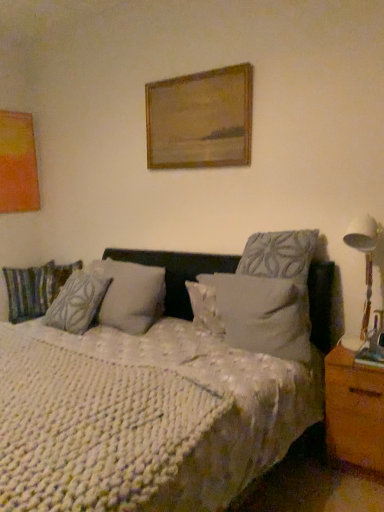
What is the approximate height of white fabric lampshade at right?

65.51 centimeters.

Identify the location of white fabric lampshade at right. Image resolution: width=384 pixels, height=512 pixels. (365, 266).

How many degrees apart are the facing directions of white textured pillow at center, the fourth pillow positioned from the back, and striped fabric pillow at left, the 4th pillow viewed from the right?

The angle between the facing direction of white textured pillow at center, the fourth pillow positioned from the back, and the facing direction of striped fabric pillow at left, the 4th pillow viewed from the right, is 79.6 degrees.

From a real-world perspective, is white textured pillow at center, the 3th pillow in the left-to-right sequence, beneath striped fabric pillow at left, the 4th pillow viewed from the right?

No, from a real-world perspective, white textured pillow at center, the 3th pillow in the left-to-right sequence, is not below striped fabric pillow at left, the 4th pillow viewed from the right.

Considering the positions of point (250, 296) and point (15, 288), is point (250, 296) closer or farther from the camera than point (15, 288)?

Point (250, 296) appears to be closer to the viewer than point (15, 288).

Looking at the image, does white textured pillow at center, the 3th pillow in the left-to-right sequence, seem bigger or smaller compared to striped fabric pillow at left, marked as the 1th pillow in a back-to-front arrangement?

Clearly, white textured pillow at center, the 3th pillow in the left-to-right sequence, is larger in size than striped fabric pillow at left, marked as the 1th pillow in a back-to-front arrangement.

Is striped fabric pillow at left, marked as the 1th pillow in a back-to-front arrangement, looking in the opposite direction of white knitted mattress at center?

No, striped fabric pillow at left, marked as the 1th pillow in a back-to-front arrangement,'s orientation is not away from white knitted mattress at center.

Between point (52, 282) and point (74, 466), which one is positioned in front?

The point (74, 466) is more forward.

From a real-world perspective, who is located higher, striped fabric pillow at left, which is the first pillow in left-to-right order, or white knitted mattress at center?

striped fabric pillow at left, which is the first pillow in left-to-right order, from a real-world perspective.

Are striped fabric pillow at left, the 4th pillow viewed from the right, and white textured pillow at center, the fourth pillow positioned from the back, far apart?

Yes, striped fabric pillow at left, the 4th pillow viewed from the right, and white textured pillow at center, the fourth pillow positioned from the back, are quite far apart.

Which point is more forward, (x=32, y=318) or (x=246, y=312)?

The point (x=246, y=312) is in front.

Is striped fabric pillow at left, marked as the 1th pillow in a back-to-front arrangement, located outside white textured pillow at center, the fourth pillow positioned from the back?

Yes, striped fabric pillow at left, marked as the 1th pillow in a back-to-front arrangement, is outside of white textured pillow at center, the fourth pillow positioned from the back.

Locate an element on the screen. The image size is (384, 512). the 2nd pillow to the right when counting from the striped fabric pillow at left, the fourth pillow when ordered from front to back is located at coordinates (262, 314).

Is textured gray pillow at center, the second pillow when ordered from front to back, wider or thinner than white knitted mattress at center?

In the image, textured gray pillow at center, the second pillow when ordered from front to back, appears to be more narrow than white knitted mattress at center.

Is point (290, 247) positioned after point (195, 444)?

Yes, it is behind point (195, 444).

The image size is (384, 512). I want to click on mattress located on the left of textured gray pillow at center, acting as the third pillow starting from the back, so click(x=92, y=426).

Which is closer, (147,452) or (354,229)?

Point (147,452)

Are white knitted blanket at center and white fabric lampshade at right far apart?

No, white knitted blanket at center is not far away from white fabric lampshade at right.

Consider the image. Is white knitted blanket at center shorter than white fabric lampshade at right?

In fact, white knitted blanket at center may be taller than white fabric lampshade at right.

The image size is (384, 512). In order to click on table lamp on the left of the brown wood nightstand at lower right in this screenshot , I will do `click(365, 266)`.

Is brown wood nightstand at lower right spatially inside white fabric lampshade at right, or outside of it?

brown wood nightstand at lower right is located beyond the bounds of white fabric lampshade at right.

Considering the points (351, 401) and (360, 331), which point is in front, point (351, 401) or point (360, 331)?

The point (351, 401) is closer to the camera.

Can you confirm if brown wood nightstand at lower right is taller than white fabric lampshade at right?

No, brown wood nightstand at lower right is not taller than white fabric lampshade at right.

Is striped fabric pillow at left, which is the first pillow in left-to-right order, inside the boundaries of white fabric lampshade at right, or outside?

striped fabric pillow at left, which is the first pillow in left-to-right order, is not inside white fabric lampshade at right, it's outside.

Does striped fabric pillow at left, which is the first pillow in left-to-right order, have a smaller size compared to white fabric lampshade at right?

Incorrect, striped fabric pillow at left, which is the first pillow in left-to-right order, is not smaller in size than white fabric lampshade at right.

From the image's perspective, which is above, striped fabric pillow at left, the fourth pillow when ordered from front to back, or white fabric lampshade at right?

white fabric lampshade at right, from the image's perspective.

In the scene shown: Which point is more distant from viewer, (x=17, y=314) or (x=357, y=349)?

Positioned behind is point (x=17, y=314).

The width and height of the screenshot is (384, 512). What are the coordinates of `the 3rd pillow in front of the striped fabric pillow at left, marked as the 1th pillow in a back-to-front arrangement, counting from the anchor's position` in the screenshot? It's located at (262, 314).

The image size is (384, 512). In the image, there is a striped fabric pillow at left, marked as the 1th pillow in a back-to-front arrangement. Identify the location of mattress below it (from a real-world perspective). (92, 426).

Based on the photo, based on their spatial positions, is wooden framed painting at upper center or white fabric lampshade at right further from striped fabric pillow at left, which is the first pillow in left-to-right order?

The object further to striped fabric pillow at left, which is the first pillow in left-to-right order, is white fabric lampshade at right.

Looking at the image, which one is located closer to striped fabric pillow at left, the fourth pillow when ordered from front to back, white knitted blanket at center or white textured pillow at center, the 2th pillow in the right-to-left sequence?

white knitted blanket at center is positioned closer to the anchor striped fabric pillow at left, the fourth pillow when ordered from front to back.

Considering their positions, is white fabric lampshade at right positioned further to wooden framed painting at upper center than white textured pillow at center, the 2th pillow in the right-to-left sequence?

white fabric lampshade at right is positioned further to the anchor wooden framed painting at upper center.

When comparing their distances from white fabric lampshade at right, does striped fabric pillow at left, the fourth pillow when ordered from front to back, or wooden framed painting at upper center seem further?

striped fabric pillow at left, the fourth pillow when ordered from front to back, lies further to white fabric lampshade at right than the other object.

When comparing their distances from textured gray pillow at center, acting as the second pillow starting from the left, does striped fabric pillow at left, which is the first pillow in left-to-right order, or white knitted blanket at center seem closer?

Among the two, white knitted blanket at center is located nearer to textured gray pillow at center, acting as the second pillow starting from the left.

When comparing their distances from brown wood nightstand at lower right, does textured gray pillow at center, positioned as the 4th pillow in left-to-right order, or striped fabric pillow at left, which is the first pillow in left-to-right order, seem closer?

Based on the image, textured gray pillow at center, positioned as the 4th pillow in left-to-right order, appears to be nearer to brown wood nightstand at lower right.

Which object lies further to the anchor point striped fabric pillow at left, the 4th pillow viewed from the right, wooden framed painting at upper center or white knitted blanket at center?

Among the two, white knitted blanket at center is located further to striped fabric pillow at left, the 4th pillow viewed from the right.

From the image, which object appears to be farther from brown wood nightstand at lower right, striped fabric pillow at left, the fourth pillow when ordered from front to back, or wooden framed painting at upper center?

The object further to brown wood nightstand at lower right is striped fabric pillow at left, the fourth pillow when ordered from front to back.

Identify the location of mattress between white knitted blanket at center and wooden framed painting at upper center in the front-back direction. (92, 426).

The height and width of the screenshot is (512, 384). What are the coordinates of `picture frame between striped fabric pillow at left, the 4th pillow viewed from the right, and brown wood nightstand at lower right from left to right` in the screenshot? It's located at (200, 119).

Locate an element on the screen. This screenshot has width=384, height=512. pillow between textured gray pillow at center, which is the 3th pillow from right to left, and textured gray pillow at center, acting as the third pillow starting from the back, in the horizontal direction is located at coordinates (262, 314).

You are a GUI agent. You are given a task and a screenshot of the screen. Output one action in this format:
    pyautogui.click(x=<x>, y=<y>)
    Task: Click on the table lamp between textured gray pillow at center, the 3th pillow positioned from the front, and brown wood nightstand at lower right, in the horizontal direction
    
    Given the screenshot: What is the action you would take?
    pyautogui.click(x=365, y=266)